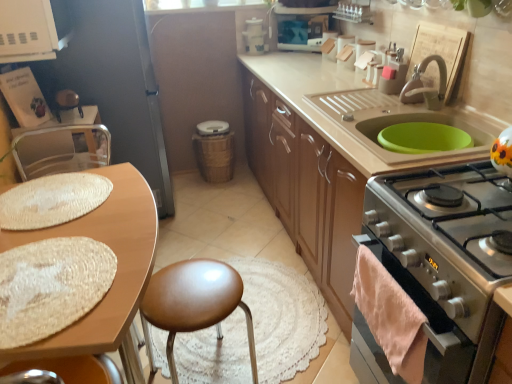
Find the location of a particular element. Image resolution: width=512 pixels, height=384 pixels. spots to the right of woven brown trash can at center, positioned as the 1th appliance in bottom-to-top order is located at coordinates (246, 182).